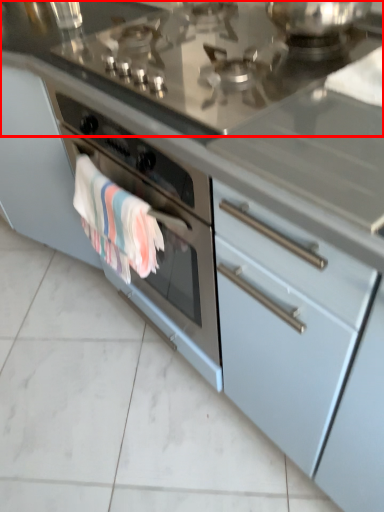
Question: From the image's perspective, where is countertop (annotated by the red box) located relative to bath towel?

Choices:
 (A) above
 (B) below

Answer: (A)